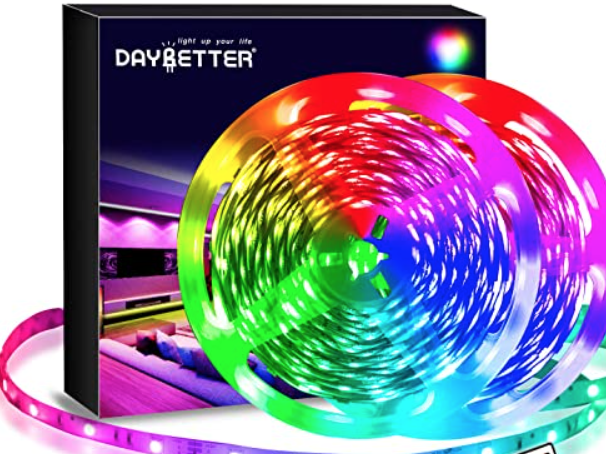
You are a GUI agent. You are given a task and a screenshot of the screen. Output one action in this format:
    pyautogui.click(x=<x>, y=<y>)
    Task: Click on the led strip multicolor lights
    The height and width of the screenshot is (454, 606).
    Given the screenshot: What is the action you would take?
    pyautogui.click(x=545, y=304), pyautogui.click(x=345, y=385), pyautogui.click(x=350, y=235), pyautogui.click(x=551, y=176), pyautogui.click(x=285, y=176), pyautogui.click(x=108, y=323), pyautogui.click(x=62, y=134), pyautogui.click(x=107, y=57), pyautogui.click(x=456, y=44)